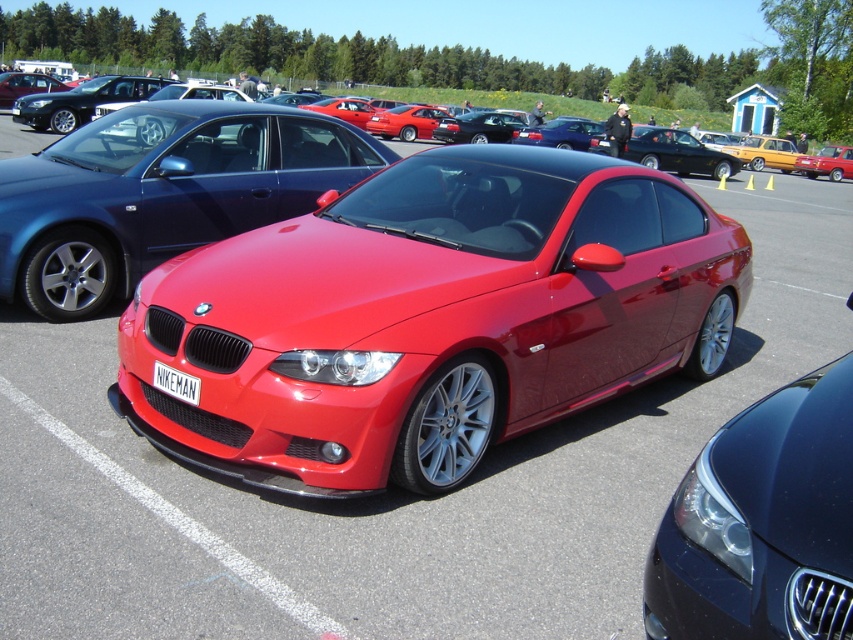
You are a photographer trying to capture a photo of the metallic red car at center and the matte black car at upper left. If you want to ensure both cars are in the same frame, which direction should you move your camera? Explain your reasoning based on their positions.

The metallic red car at center is located below the matte black car at upper left. To include both in the same frame, you should move your camera downward to capture the metallic red car at center while still keeping the matte black car at upper left in view.

You are standing at the point marked by coordinates point (x=827, y=163). What object are you directly facing?

The point (x=827, y=163) marks the metallic red car at center, so you are directly facing the metallic red car at center.